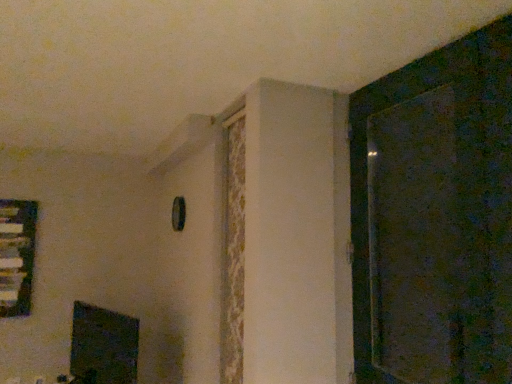
Question: In terms of width, does dark textured screen door at right look wider or thinner when compared to black glossy fireplace at lower left?

Choices:
 (A) thin
 (B) wide

Answer: (A)

Question: In terms of height, does dark textured screen door at right look taller or shorter compared to black glossy fireplace at lower left?

Choices:
 (A) tall
 (B) short

Answer: (A)

Question: Which of these objects is positioned farthest from the black glossy fireplace at lower left?

Choices:
 (A) clear glass window at left
 (B) dark textured screen door at right

Answer: (B)

Question: Which is farther from the clear glass window at left?

Choices:
 (A) dark textured screen door at right
 (B) black glossy fireplace at lower left

Answer: (A)